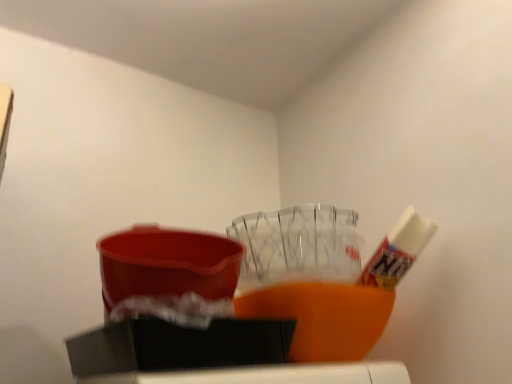
Question: Is matte plastic basin at center facing towards white glossy tube at upper right?

Choices:
 (A) yes
 (B) no

Answer: (B)

Question: Considering the relative sizes of matte plastic basin at center and white glossy tube at upper right in the image provided, is matte plastic basin at center bigger than white glossy tube at upper right?

Choices:
 (A) no
 (B) yes

Answer: (B)

Question: Can you confirm if matte plastic basin at center is smaller than white glossy tube at upper right?

Choices:
 (A) yes
 (B) no

Answer: (B)

Question: Is matte plastic basin at center at the right side of white glossy tube at upper right?

Choices:
 (A) yes
 (B) no

Answer: (B)

Question: Can you confirm if matte plastic basin at center is shorter than white glossy tube at upper right?

Choices:
 (A) no
 (B) yes

Answer: (B)

Question: Is matte plastic basin at center outside white glossy tube at upper right?

Choices:
 (A) no
 (B) yes

Answer: (B)

Question: Is white glossy tube at upper right at the left side of matte plastic basin at center?

Choices:
 (A) yes
 (B) no

Answer: (B)

Question: Is white glossy tube at upper right not close to matte plastic basin at center?

Choices:
 (A) no
 (B) yes

Answer: (A)

Question: From the image's perspective, does white glossy tube at upper right appear lower than matte plastic basin at center?

Choices:
 (A) yes
 (B) no

Answer: (A)

Question: Is white glossy tube at upper right outside of matte plastic basin at center?

Choices:
 (A) no
 (B) yes

Answer: (B)

Question: Can you confirm if white glossy tube at upper right is taller than matte plastic basin at center?

Choices:
 (A) yes
 (B) no

Answer: (A)

Question: Would you say white glossy tube at upper right contains matte plastic basin at center?

Choices:
 (A) yes
 (B) no

Answer: (B)

Question: Is white glossy tube at upper right to the left or to the right of matte plastic basin at center in the image?

Choices:
 (A) right
 (B) left

Answer: (A)